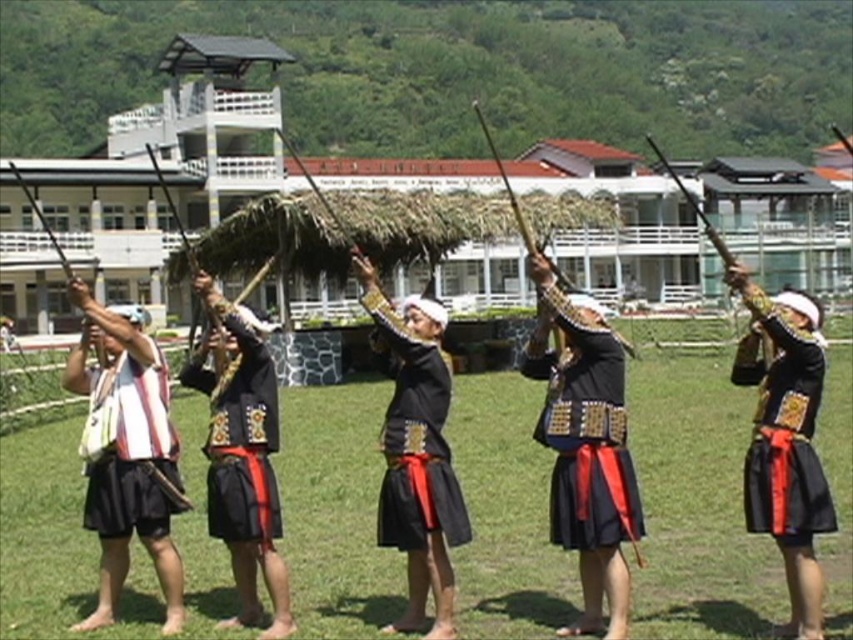
Can you confirm if green grass at center is wider than black matte cloth at center?

Correct, the width of green grass at center exceeds that of black matte cloth at center.

Does green grass at center have a greater height compared to black matte cloth at center?

Yes.

Is point (672, 538) positioned before point (216, 456)?

No.

Locate an element on the screen. This screenshot has height=640, width=853. green grass at center is located at coordinates [x=695, y=502].

Is point (746, 456) closer to camera compared to point (151, 435)?

Yes, it is in front of point (151, 435).

Is point (756, 468) more distant than point (128, 404)?

No.

This screenshot has height=640, width=853. Find the location of `black satin robe at center`. black satin robe at center is located at coordinates (782, 435).

Locate an element on the screen. Image resolution: width=853 pixels, height=640 pixels. black satin robe at center is located at coordinates (782, 435).

Does black matte skirt at center appear over black matte cloth at center?

Correct, black matte skirt at center is located above black matte cloth at center.

Describe the element at coordinates (585, 436) in the screenshot. This screenshot has width=853, height=640. I see `black matte skirt at center` at that location.

The height and width of the screenshot is (640, 853). What are the coordinates of `black matte skirt at center` in the screenshot? It's located at (585, 436).